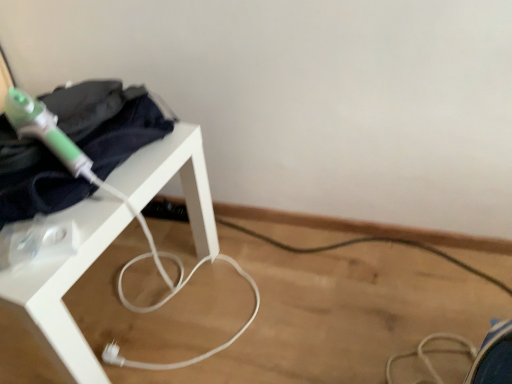
Question: Is white matte table at left positioned far away from dark blue fabric at upper left?

Choices:
 (A) no
 (B) yes

Answer: (A)

Question: Can you confirm if white matte table at left is smaller than dark blue fabric at upper left?

Choices:
 (A) no
 (B) yes

Answer: (A)

Question: Considering the relative sizes of white matte table at left and dark blue fabric at upper left in the image provided, is white matte table at left shorter than dark blue fabric at upper left?

Choices:
 (A) yes
 (B) no

Answer: (B)

Question: Is white matte table at left to the left of dark blue fabric at upper left from the viewer's perspective?

Choices:
 (A) no
 (B) yes

Answer: (B)

Question: From the image's perspective, is white matte table at left beneath dark blue fabric at upper left?

Choices:
 (A) no
 (B) yes

Answer: (B)

Question: Considering the relative sizes of white matte table at left and dark blue fabric at upper left in the image provided, is white matte table at left thinner than dark blue fabric at upper left?

Choices:
 (A) yes
 (B) no

Answer: (B)

Question: Does dark blue fabric at upper left come behind white matte table at left?

Choices:
 (A) yes
 (B) no

Answer: (A)

Question: Is dark blue fabric at upper left to the left of white matte table at left from the viewer's perspective?

Choices:
 (A) yes
 (B) no

Answer: (B)

Question: From a real-world perspective, does dark blue fabric at upper left sit lower than white matte table at left?

Choices:
 (A) no
 (B) yes

Answer: (A)

Question: Considering the relative sizes of dark blue fabric at upper left and white matte table at left in the image provided, is dark blue fabric at upper left bigger than white matte table at left?

Choices:
 (A) yes
 (B) no

Answer: (B)

Question: Does dark blue fabric at upper left turn towards white matte table at left?

Choices:
 (A) yes
 (B) no

Answer: (B)

Question: Considering the relative positions of dark blue fabric at upper left and white matte table at left in the image provided, is dark blue fabric at upper left to the right of white matte table at left from the viewer's perspective?

Choices:
 (A) yes
 (B) no

Answer: (A)

Question: Considering the positions of dark blue fabric at upper left and white matte table at left in the image, is dark blue fabric at upper left wider or thinner than white matte table at left?

Choices:
 (A) wide
 (B) thin

Answer: (B)